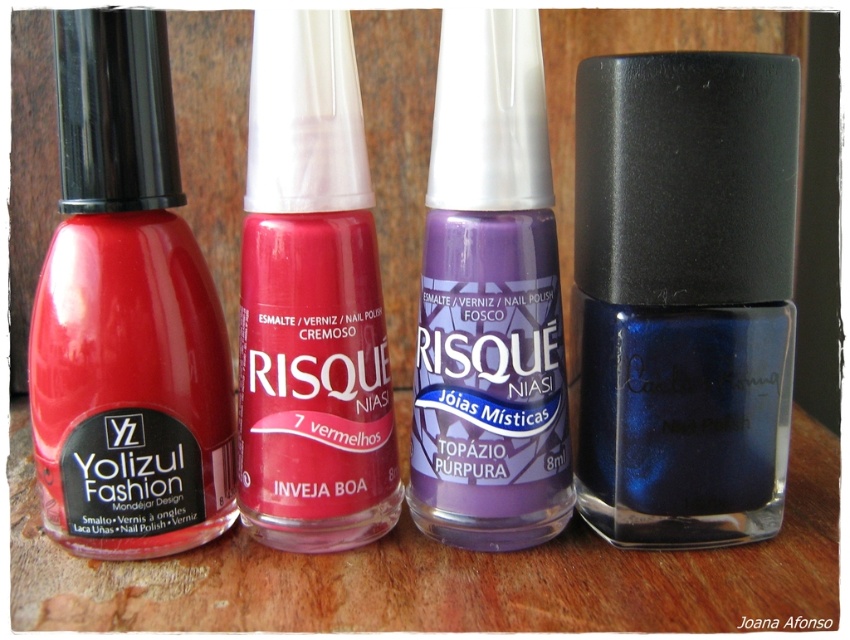
Does glossy blue nail polish at right appear on the right side of matte red nail polish at center?

Indeed, glossy blue nail polish at right is positioned on the right side of matte red nail polish at center.

Is glossy blue nail polish at right thinner than matte red nail polish at center?

No, glossy blue nail polish at right is not thinner than matte red nail polish at center.

Is point (599, 234) behind point (378, 490)?

No, it is in front of (378, 490).

The width and height of the screenshot is (850, 640). Find the location of `glossy blue nail polish at right`. glossy blue nail polish at right is located at coordinates (684, 294).

Can you confirm if matte glass nail polish at left is positioned to the left of matte red nail polish at center?

Correct, you'll find matte glass nail polish at left to the left of matte red nail polish at center.

Which is in front, point (95, 470) or point (344, 442)?

Point (95, 470)

Identify the location of matte glass nail polish at left. (126, 314).

Where is `matte glass nail polish at left`? matte glass nail polish at left is located at coordinates (126, 314).

Consider the image. Measure the distance between matte glass nail polish at left and camera.

matte glass nail polish at left is 32.00 inches away from camera.

Consider the image. Between matte glass nail polish at left and transparent glass bottles at center, which one is positioned higher?

Positioned higher is matte glass nail polish at left.

Image resolution: width=850 pixels, height=640 pixels. What do you see at coordinates (126, 314) in the screenshot?
I see `matte glass nail polish at left` at bounding box center [126, 314].

Find the location of a particular element. The image size is (850, 640). matte glass nail polish at left is located at coordinates (126, 314).